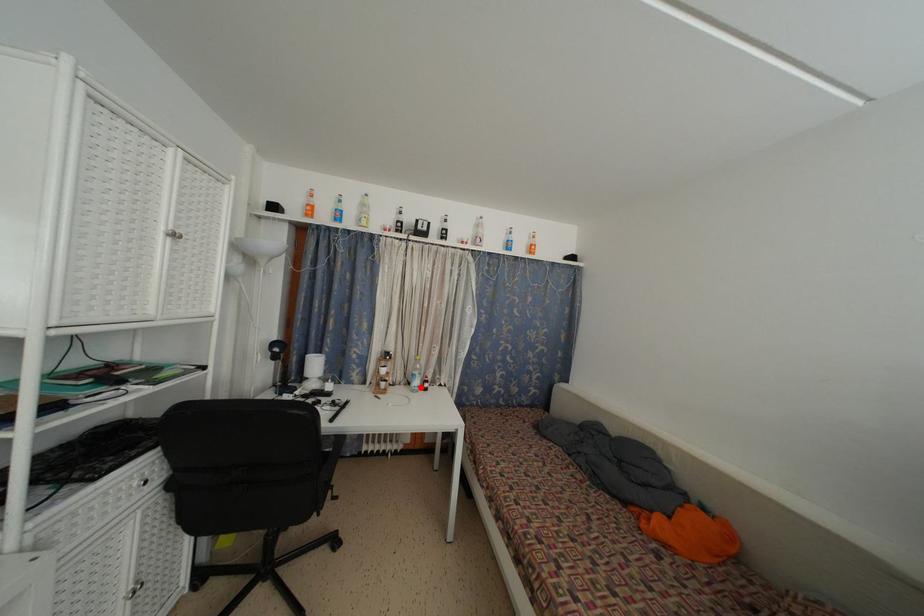
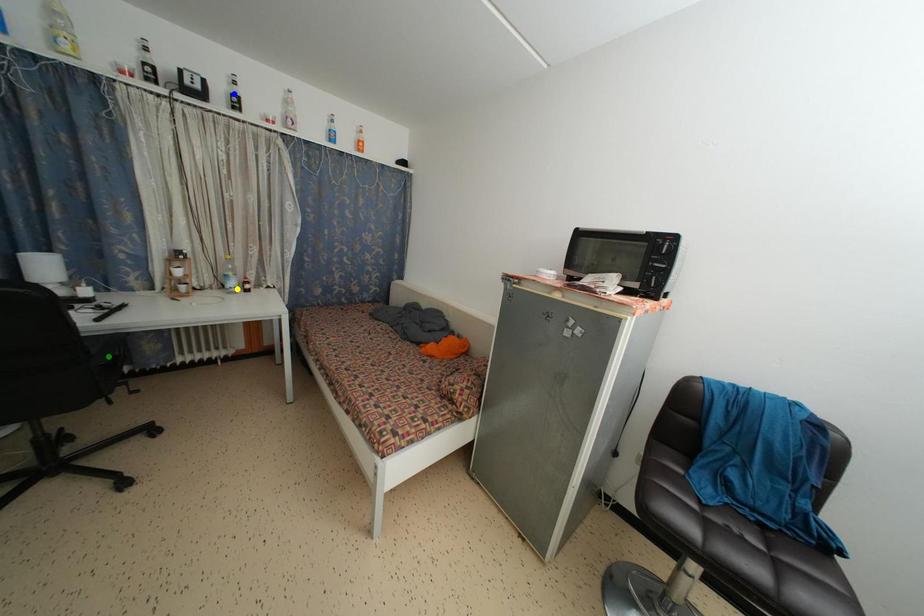
Question: I am providing you with two images of the same scene from different viewpoints. A red point is marked on the first image. You are given multiple points on the second image. Which point in image 2 represents the same 3d spot as the red point in image 1?

Choices:
 (A) yellow point
 (B) blue point
 (C) green point

Answer: (A)